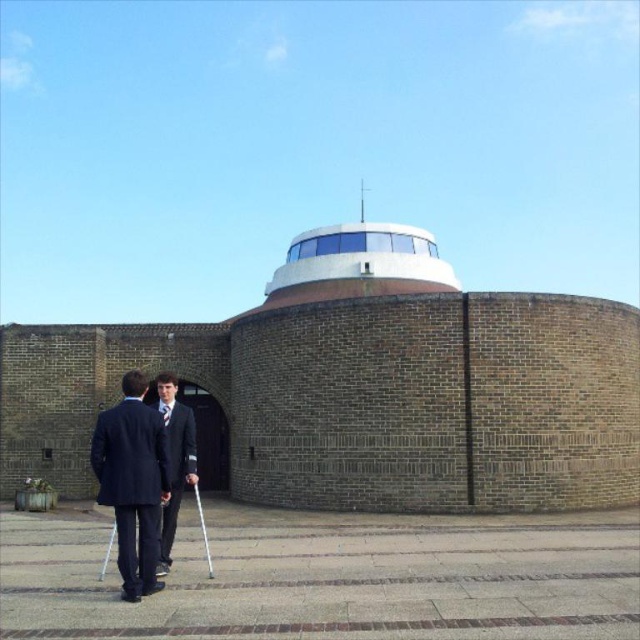
You are a construction worker standing next to the dark blue suit at lower left. You need to reach the white smooth dome at center for maintenance. Considering the distance, can you safely walk there without any equipment?

The distance between the dark blue suit at lower left and the white smooth dome at center is 152.87 feet. Since this is a considerable distance, you would need to use appropriate equipment or vehicles to safely traverse the area, as walking such a long distance might be impractical or unsafe depending on terrain and time constraints.

Looking at this image, you are standing in front of the modern architectural structure and see the dark blue suit at lower left and the white smooth dome at center. Which object is positioned to the left of the other?

The dark blue suit at lower left is to the left of the white smooth dome at center.